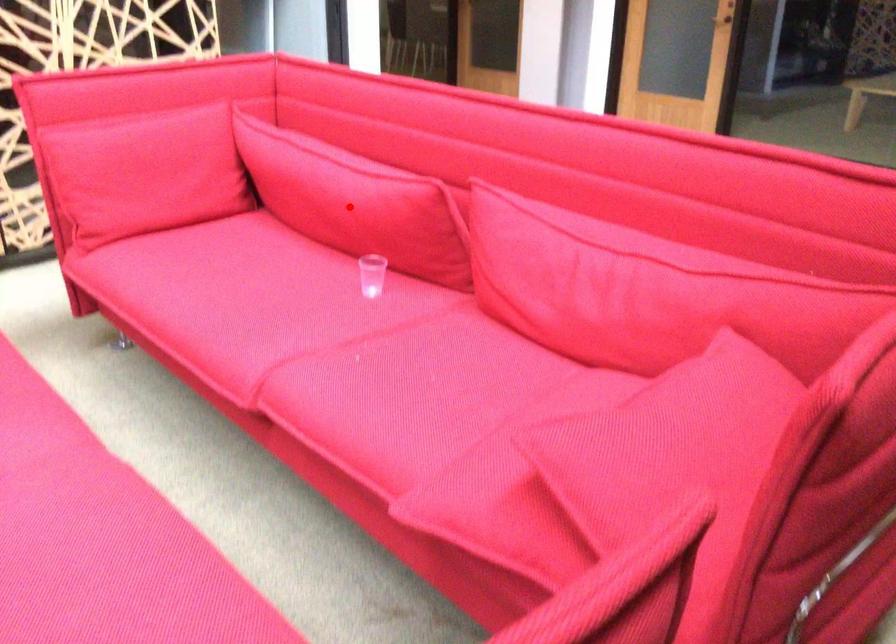
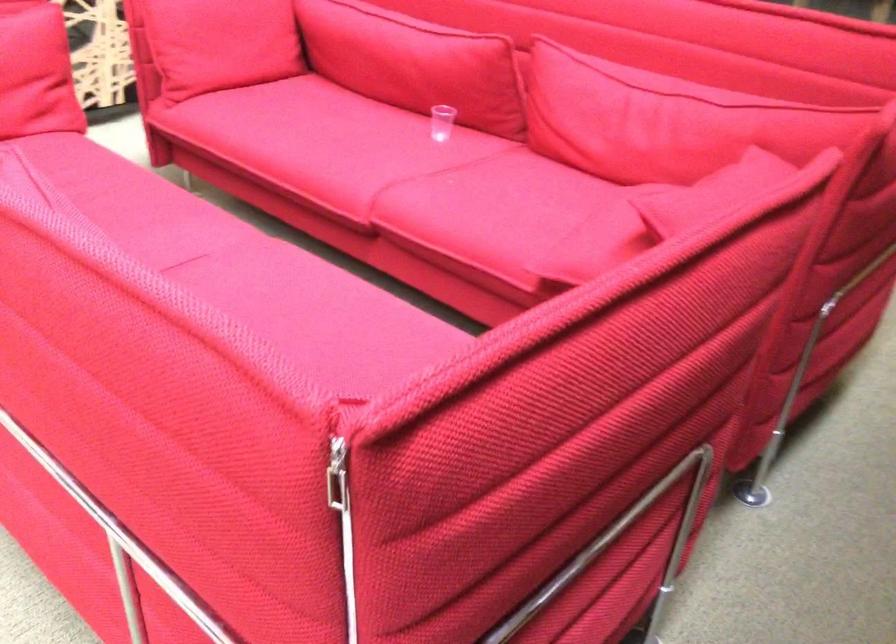
Question: I am providing you with two images of the same scene from different viewpoints. A red point is shown in image1. For the corresponding object point in image2, is it positioned nearer or farther from the camera?

Choices:
 (A) Nearer
 (B) Farther

Answer: (B)